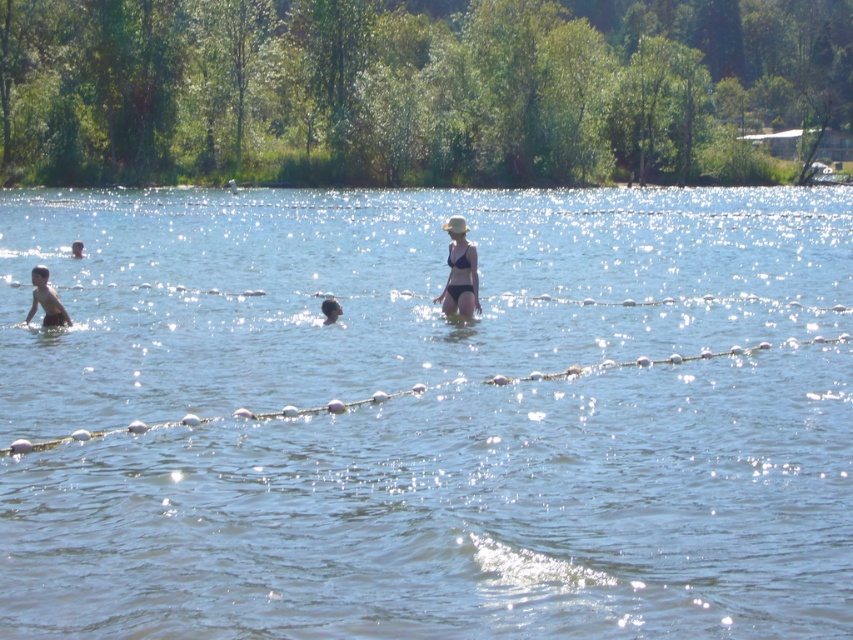
Question: Is clear water at center bigger than black matte bikini at center?

Choices:
 (A) yes
 (B) no

Answer: (A)

Question: Among these points, which one is nearest to the camera?

Choices:
 (A) (444, 227)
 (B) (74, 241)
 (C) (51, 300)

Answer: (C)

Question: Does dark brown hair at center appear on the right side of dark blue swimmer at left?

Choices:
 (A) no
 (B) yes

Answer: (B)

Question: Which is nearer to the dark brown hair at center?

Choices:
 (A) black matte bikini at center
 (B) light brown skin at left
 (C) clear water at center

Answer: (A)

Question: Which point appears farthest from the camera in this image?

Choices:
 (A) (33, 273)
 (B) (523, 278)
 (C) (466, 248)
 (D) (82, 243)

Answer: (D)

Question: From the image, what is the correct spatial relationship of dark brown hair at center in relation to dark blue swimmer at left?

Choices:
 (A) left
 (B) right

Answer: (B)